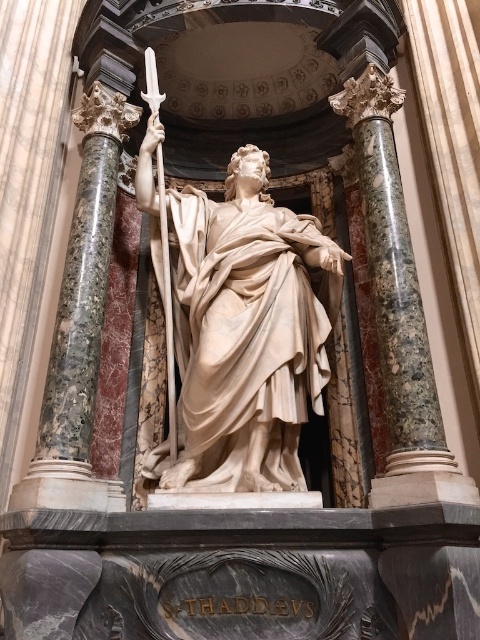
Who is higher up, matte white statue at center or green marble column at right?

green marble column at right is higher up.

Locate an element on the screen. This screenshot has height=640, width=480. matte white statue at center is located at coordinates (247, 333).

Where is `matte white statue at center`? The width and height of the screenshot is (480, 640). matte white statue at center is located at coordinates click(x=247, y=333).

Does green marble column at center have a greater width compared to polished silver sword at center?

Yes, green marble column at center is wider than polished silver sword at center.

Between green marble column at center and polished silver sword at center, which one has less height?

Standing shorter between the two is green marble column at center.

Which is in front, point (26, 492) or point (159, 102)?

Point (26, 492) is in front.

You are a GUI agent. You are given a task and a screenshot of the screen. Output one action in this format:
    pyautogui.click(x=<x>, y=<y>)
    Task: Click on the green marble column at center
    This screenshot has height=640, width=480.
    Given the screenshot: What is the action you would take?
    [80, 317]

Who is taller, green marble column at right or green marble column at center?

green marble column at right

Can you confirm if green marble column at right is taller than green marble column at center?

Correct, green marble column at right is much taller as green marble column at center.

You are a GUI agent. You are given a task and a screenshot of the screen. Output one action in this format:
    pyautogui.click(x=<x>, y=<y>)
    Task: Click on the green marble column at right
    
    Given the screenshot: What is the action you would take?
    pyautogui.click(x=397, y=308)

Locate an element on the screen. green marble column at right is located at coordinates (397, 308).